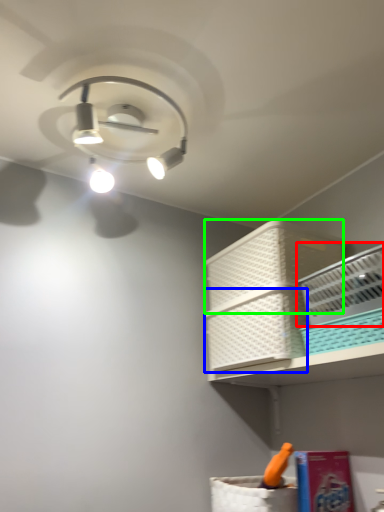
Question: Which is farther away from basket (highlighted by a red box)? basket (highlighted by a blue box) or basket (highlighted by a green box)?

Choices:
 (A) basket
 (B) basket

Answer: (B)